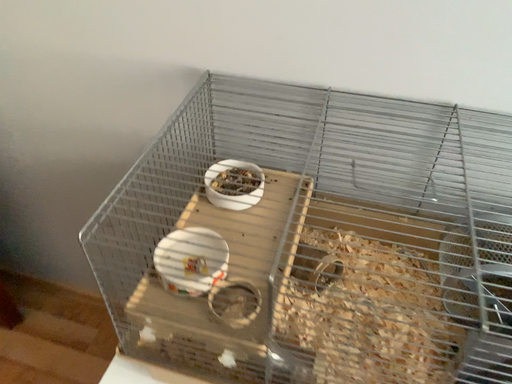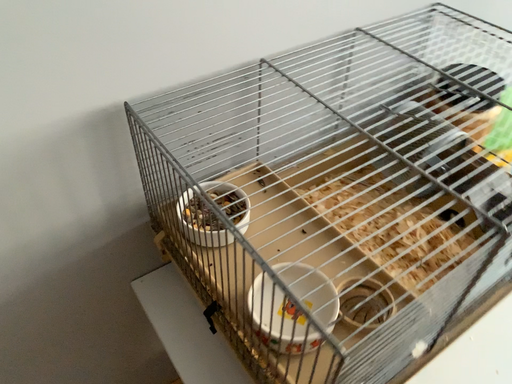
Question: How did the camera likely rotate when shooting the video?

Choices:
 (A) rotated upward
 (B) rotated downward

Answer: (A)